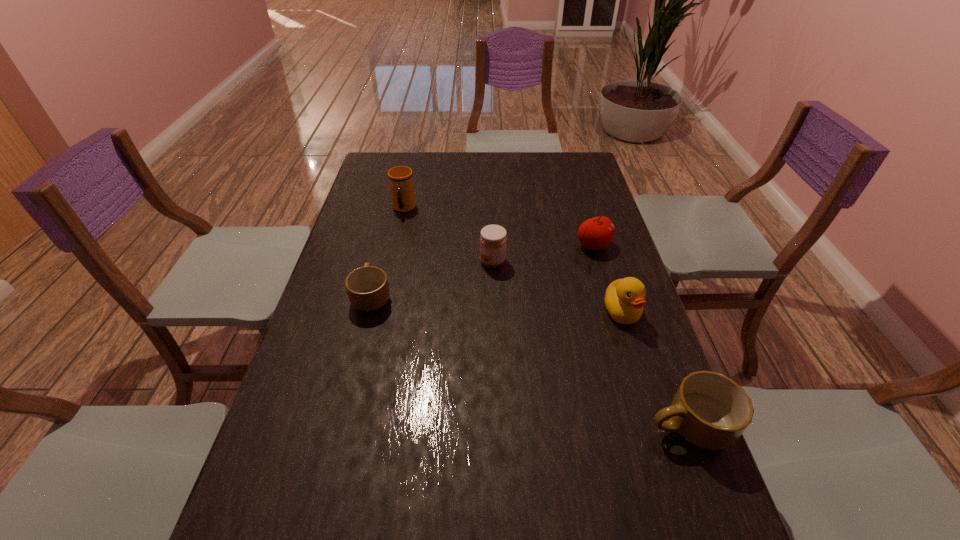
Locate which object is the second closest to the taller mug. Please provide its 2D coordinates. Your answer should be formatted as a tuple, i.e. [(x, y)], where the tuple contains the x and y coordinates of a point satisfying the conditions above.

[(596, 233)]

The width and height of the screenshot is (960, 540). Identify the location of vacant area that satisfies the following two spatial constraints: 1. on the side with the handle of the shortest object; 2. on the left side of the apple. (385, 246).

In order to click on free space that satisfies the following two spatial constraints: 1. on the front label of the third object from left to right; 2. on the side with the handle of the nearest object in this screenshot , I will do `click(498, 426)`.

The width and height of the screenshot is (960, 540). I want to click on vacant space that satisfies the following two spatial constraints: 1. at the beak of the duck; 2. on the side with the handle of the nearest object, so click(658, 426).

Identify the location of vacant region that satisfies the following two spatial constraints: 1. on the front label of the fourth object from right to left; 2. on the side with the handle of the nearer mug. (498, 426).

Locate an element on the screen. The height and width of the screenshot is (540, 960). vacant space that satisfies the following two spatial constraints: 1. on the side of the apple with the handle; 2. on the right side of the farthest object is located at coordinates (396, 246).

The height and width of the screenshot is (540, 960). In order to click on free space that satisfies the following two spatial constraints: 1. on the side with the handle of the right mug; 2. on the front label of the jam in this screenshot , I will do `click(628, 262)`.

The image size is (960, 540). In order to click on vacant region that satisfies the following two spatial constraints: 1. at the beak of the duck; 2. on the side with the handle of the taller mug in this screenshot , I will do `click(658, 426)`.

You are a GUI agent. You are given a task and a screenshot of the screen. Output one action in this format:
    pyautogui.click(x=<x>, y=<y>)
    Task: Click on the vacant position in the image that satisfies the following two spatial constraints: 1. on the side of the farthest object with the handle; 2. on the side with the handle of the nearer mug
    
    Given the screenshot: What is the action you would take?
    pyautogui.click(x=356, y=426)